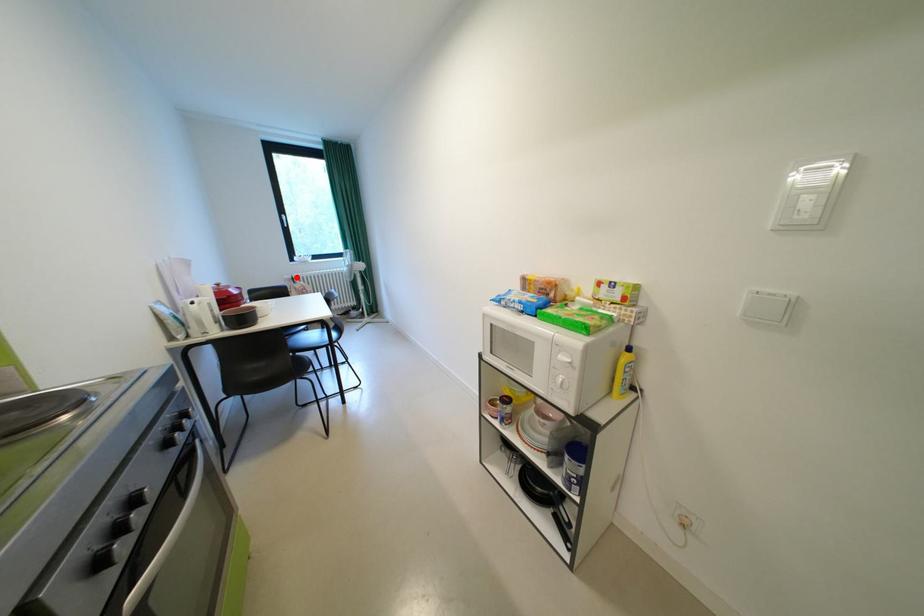
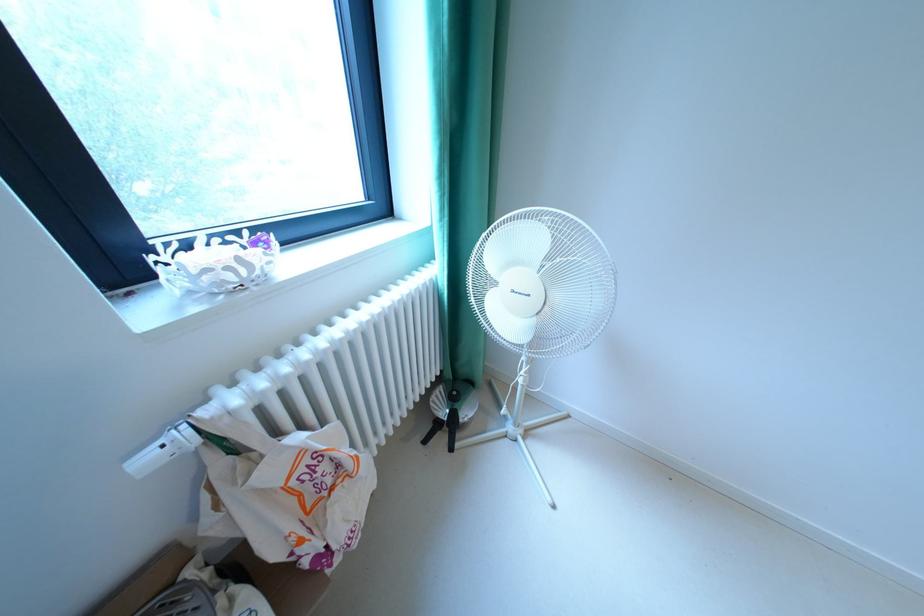
In the second image, find the point that corresponds to the highlighted location in the first image.

(156, 460)